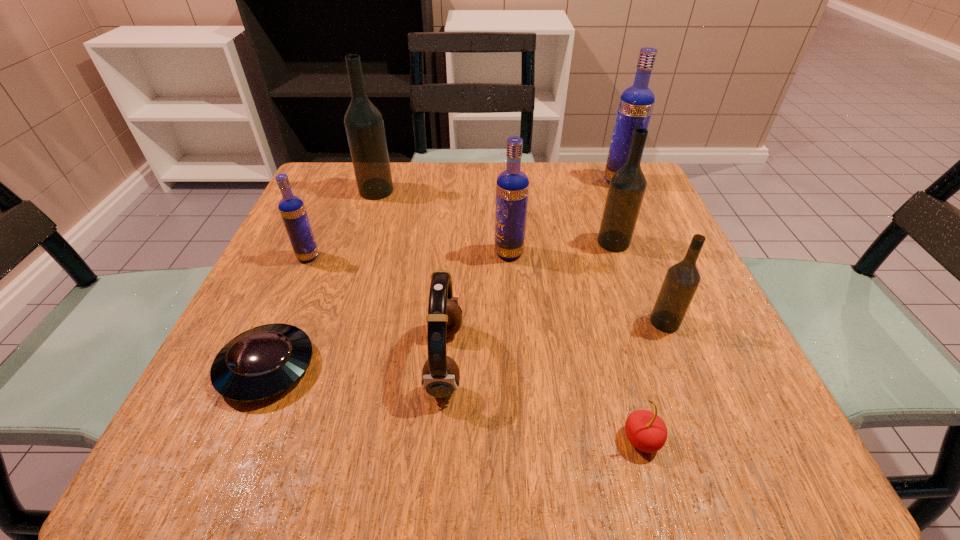
Locate an element on the screen. the nearest black vodka is located at coordinates (681, 281).

Find the location of `the fourth object from left to right`. the fourth object from left to right is located at coordinates (440, 376).

The image size is (960, 540). I want to click on headset, so click(x=440, y=376).

This screenshot has height=540, width=960. I want to click on the nearest object, so click(x=646, y=431).

Where is `cherry`? This screenshot has width=960, height=540. cherry is located at coordinates (646, 431).

Find the location of a particular element. the shortest object is located at coordinates (258, 364).

You are a GUI agent. You are given a task and a screenshot of the screen. Output one action in this format:
    pyautogui.click(x=<x>, y=<y>)
    Task: Click on the saucer
    The height and width of the screenshot is (540, 960).
    Given the screenshot: What is the action you would take?
    pyautogui.click(x=258, y=364)

Locate an element on the screen. The width and height of the screenshot is (960, 540). vacant space situated 0.220m on the front of the rightmost blue vodka is located at coordinates (647, 248).

I want to click on vacant space located on the back of the biggest black vodka, so click(385, 164).

Identify the location of free spot located 0.350m on the front of the second blue vodka from right to left. (522, 431).